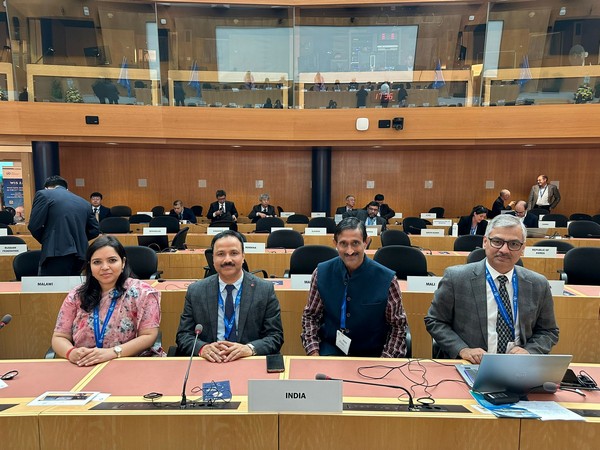
In order to click on fan in this screenshot , I will do `click(578, 57)`.